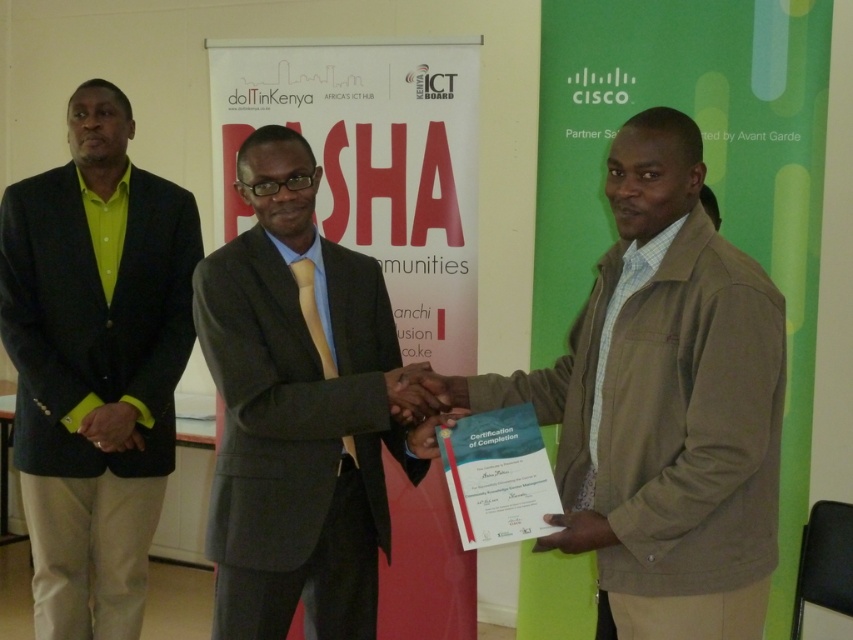
You are a photographer at the event and want to capture a photo of the brown textured jacket at center and the green matte blazer at left. From the camera view, which one appears closer to the lens?

The brown textured jacket at center appears closer to the lens because it is in front of the green matte blazer at left.

You are standing in the room and see the brown textured jacket at center and the green matte blazer at left. Which one is positioned more to the right side of the room?

The brown textured jacket at center is positioned more to the right side of the room compared to the green matte blazer at left.